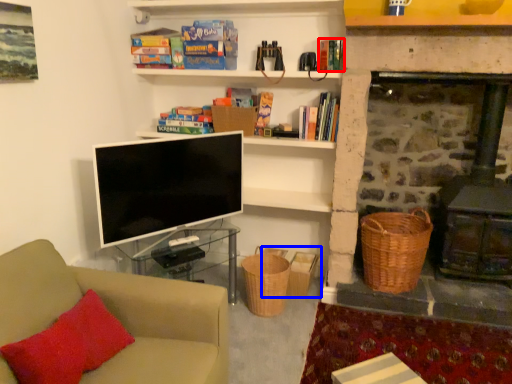
Question: Which object appears closest to the camera in this image, book (highlighted by a red box) or basket (highlighted by a blue box)?

Choices:
 (A) book
 (B) basket

Answer: (A)